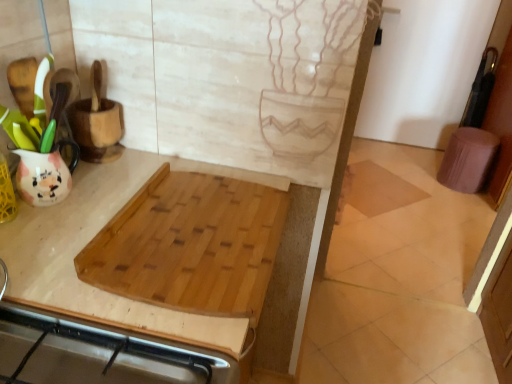
Identify the location of free spot above beige tile at center (from a real-world perspective). This screenshot has height=384, width=512. (378, 185).